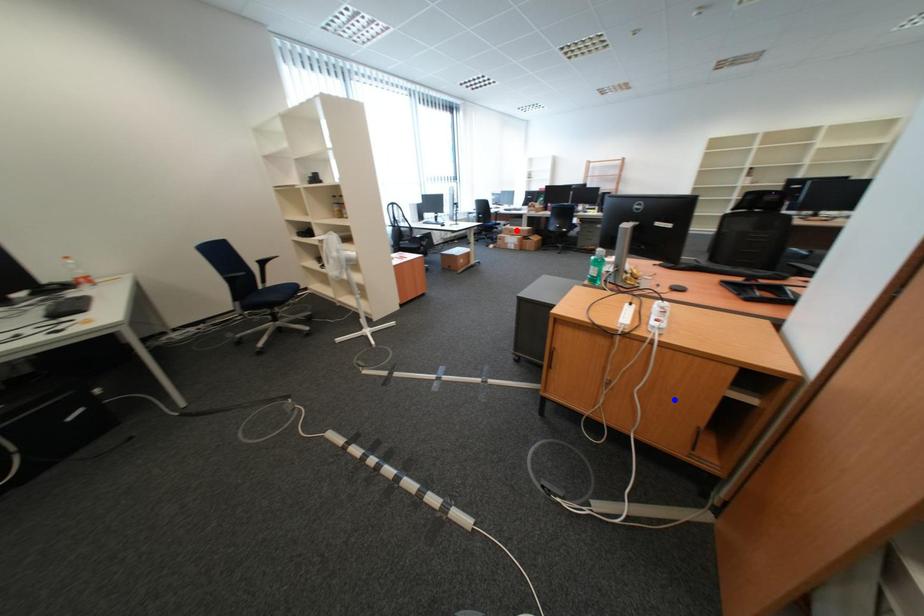
Question: In the image, two points are highlighted. Which point is nearer to the camera? Reply with the corresponding letter.

Choices:
 (A) blue point
 (B) red point

Answer: (A)